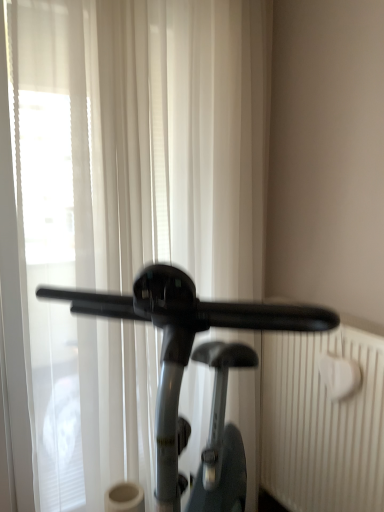
Question: Is white textured radiator at right spatially inside white sheer curtain at center, or outside of it?

Choices:
 (A) outside
 (B) inside

Answer: (A)

Question: Relative to white sheer curtain at center, is white textured radiator at right in front or behind?

Choices:
 (A) front
 (B) behind

Answer: (B)

Question: Which object is the closest to the white sheer curtain at center?

Choices:
 (A) black glossy stationary bicycle at center
 (B) white textured radiator at right

Answer: (A)

Question: Considering the real-world distances, which object is farthest from the white textured radiator at right?

Choices:
 (A) white sheer curtain at center
 (B) black glossy stationary bicycle at center

Answer: (A)